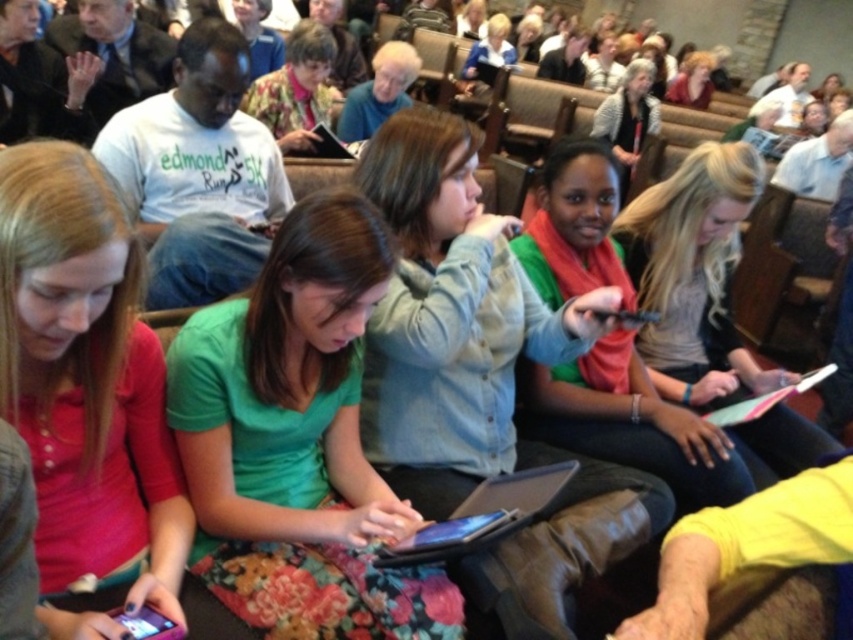
Which is behind, point (624, 92) or point (822, 160)?

The point (624, 92) is more distant.

Does matte gray sweater at center appear over light brown leather jacket at upper center?

Yes.

Between point (639, 152) and point (822, 179), which one is positioned in front?

Point (822, 179)

Image resolution: width=853 pixels, height=640 pixels. I want to click on matte gray sweater at center, so click(x=628, y=113).

Can you confirm if green fabric scarf at center is positioned to the right of matte black hand at upper left?

Yes, green fabric scarf at center is to the right of matte black hand at upper left.

Is green fabric scarf at center closer to the viewer compared to matte black hand at upper left?

Yes, it is.

I want to click on green fabric scarf at center, so click(628, 422).

Does green matte shirt at center have a lesser width compared to white matte t-shirt at center?

Incorrect, green matte shirt at center's width is not less than white matte t-shirt at center's.

Looking at this image, which is above, green matte shirt at center or white matte t-shirt at center?

white matte t-shirt at center is above.

Between point (196, 397) and point (173, 284), which one is positioned in front?

Point (196, 397)

This screenshot has height=640, width=853. I want to click on green matte shirt at center, so click(297, 442).